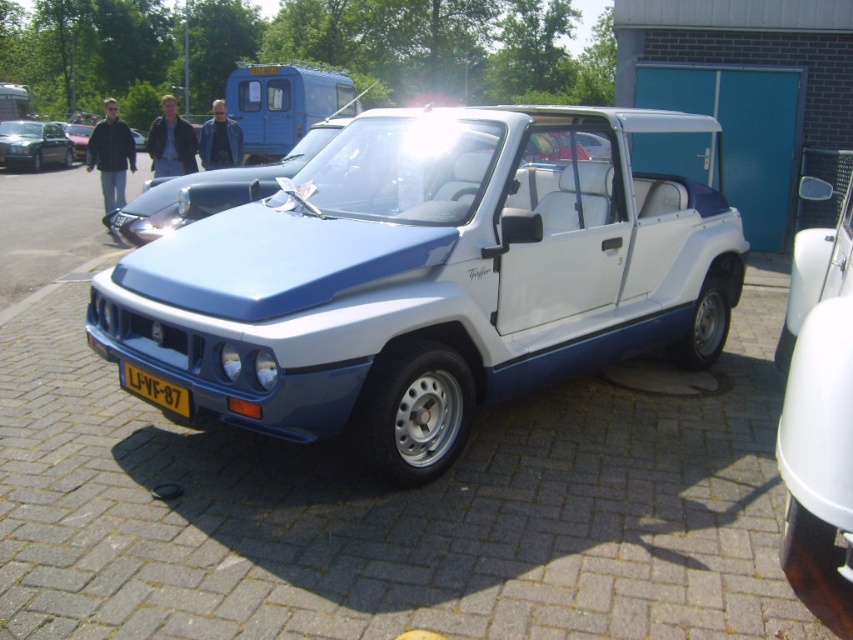
Question: Can you confirm if metallic silver car at left is wider than yellow plastic license plate at center?

Choices:
 (A) yes
 (B) no

Answer: (B)

Question: Which object is positioned closest to the yellow plastic license plate at center?

Choices:
 (A) metallic silver car at left
 (B) blue metallic car at center

Answer: (B)

Question: Which object appears closest to the camera in this image?

Choices:
 (A) blue metallic car at center
 (B) metallic silver car at left

Answer: (A)

Question: Which of these objects is positioned closest to the metallic silver car at left?

Choices:
 (A) yellow plastic license plate at center
 (B) blue metallic car at center

Answer: (A)

Question: Can you confirm if blue metallic car at center is thinner than yellow plastic license plate at center?

Choices:
 (A) yes
 (B) no

Answer: (B)

Question: Does metallic silver car at left come behind yellow plastic license plate at center?

Choices:
 (A) no
 (B) yes

Answer: (B)